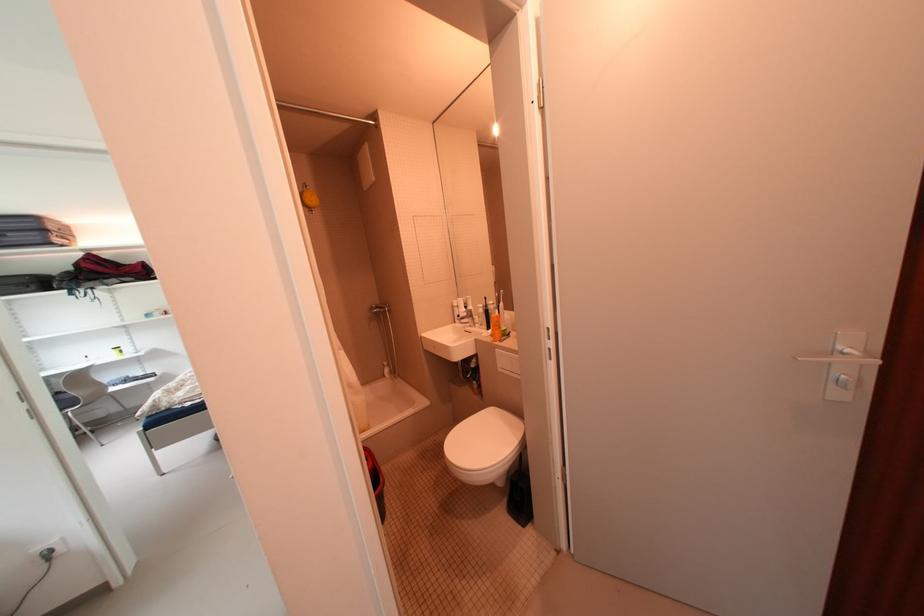
Describe the element at coordinates (841, 385) in the screenshot. I see `the door thumbturn lock` at that location.